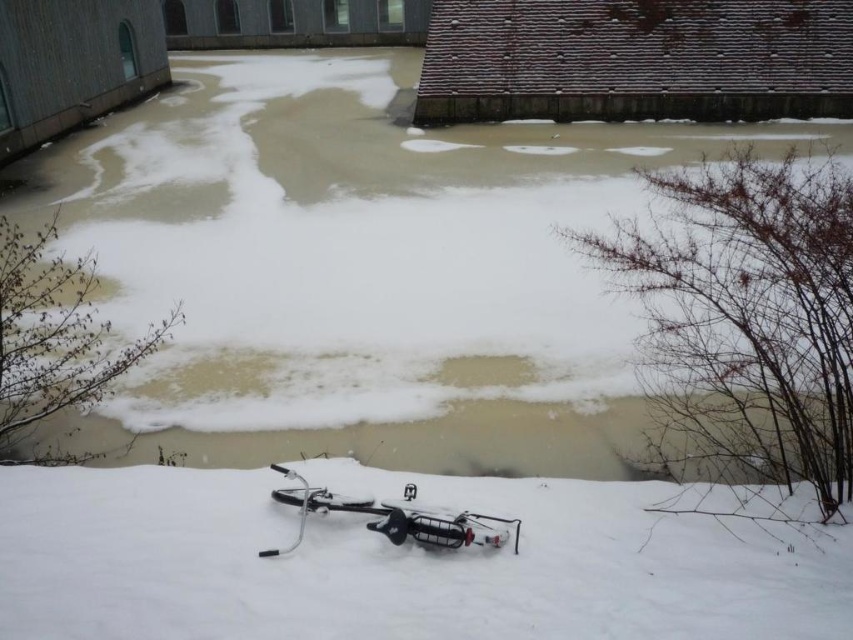
You are an explorer trying to cross the frozen lake in the image. You see the white fluffy snow at bottom and the silver metallic bicycle at lower center. Which direction should you avoid stepping on to stay safe?

You should avoid stepping on the white fluffy snow at bottom because it is to the right of the silver metallic bicycle at lower center, indicating it might be covering unstable ice.

You are a hiker who wants to cross the frozen pond. You see the white frothy water at center and the silver metallic bicycle at lower center. Which area should you avoid stepping on and why?

You should avoid stepping on the white frothy water at center because it might be wider than the silver metallic bicycle at lower center, indicating it could be thinner ice or more unstable compared to other areas.

You are an outdoor photographer wanting to capture the white frothy water at center and the white fluffy snow at bottom in the same frame. Since they are both white, how can you distinguish them in your photo?

The white frothy water at center is much taller than the white fluffy snow at bottom, so you can distinguish them by their height difference in the photo.